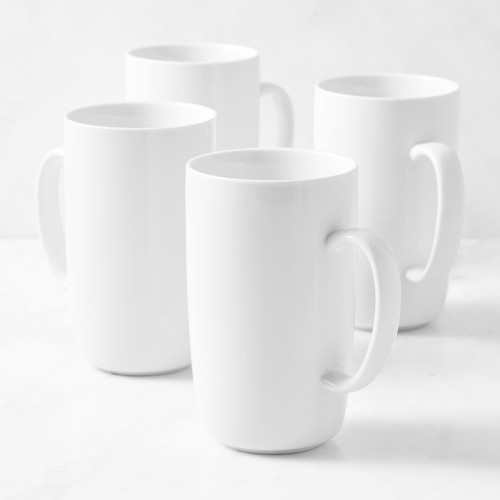
In order to click on mugs in this screenshot , I will do `click(257, 314)`, `click(168, 244)`, `click(224, 93)`, `click(380, 137)`.